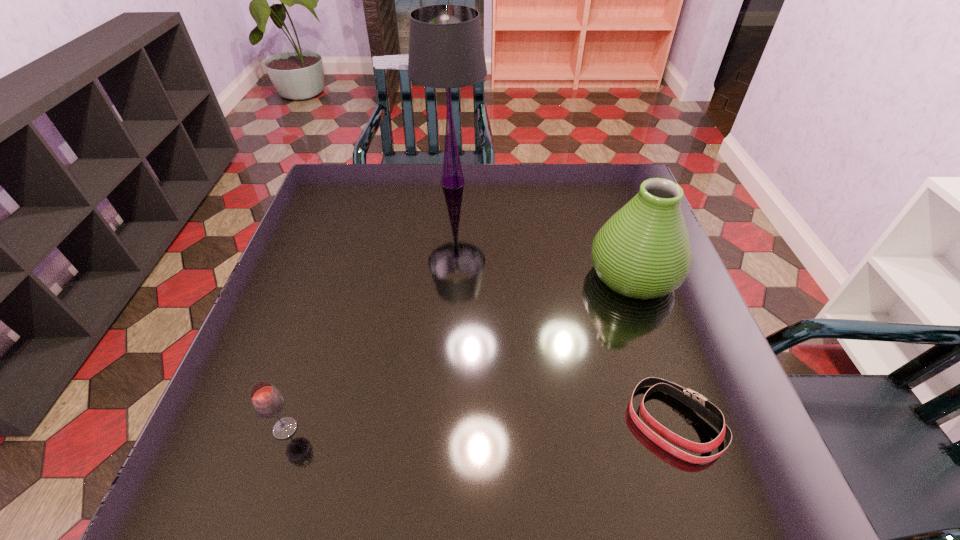
I want to click on vacant space that's between the glass drink container and the shortest object, so click(480, 426).

What are the coordinates of `object that is the third closest to the vase` in the screenshot? It's located at (267, 401).

This screenshot has width=960, height=540. What are the coordinates of `object that is the third closest to the farthest object` in the screenshot? It's located at (267, 401).

This screenshot has width=960, height=540. What are the coordinates of `free space in the image that satisfies the following two spatial constraints: 1. on the back side of the glass drink container; 2. on the right side of the shortest object` in the screenshot? It's located at (287, 423).

Image resolution: width=960 pixels, height=540 pixels. In order to click on vacant area in the image that satisfies the following two spatial constraints: 1. on the back side of the second farthest object; 2. on the left side of the shortest object in this screenshot , I will do `click(626, 275)`.

This screenshot has width=960, height=540. I want to click on free location that satisfies the following two spatial constraints: 1. on the back side of the second tallest object; 2. on the right side of the shortest object, so click(x=626, y=275).

Locate an element on the screen. free space that satisfies the following two spatial constraints: 1. on the front-facing side of the third shortest object; 2. on the left side of the lampshade is located at coordinates (445, 275).

You are a GUI agent. You are given a task and a screenshot of the screen. Output one action in this format:
    pyautogui.click(x=<x>, y=<y>)
    Task: Click on the vacant region that satisfies the following two spatial constraints: 1. on the front-facing side of the third shortest object; 2. on the left side of the lampshade
    
    Given the screenshot: What is the action you would take?
    pyautogui.click(x=445, y=275)

Find the location of a particular element. The height and width of the screenshot is (540, 960). free location that satisfies the following two spatial constraints: 1. on the front-facing side of the third object from right to left; 2. on the left side of the shortest object is located at coordinates (434, 423).